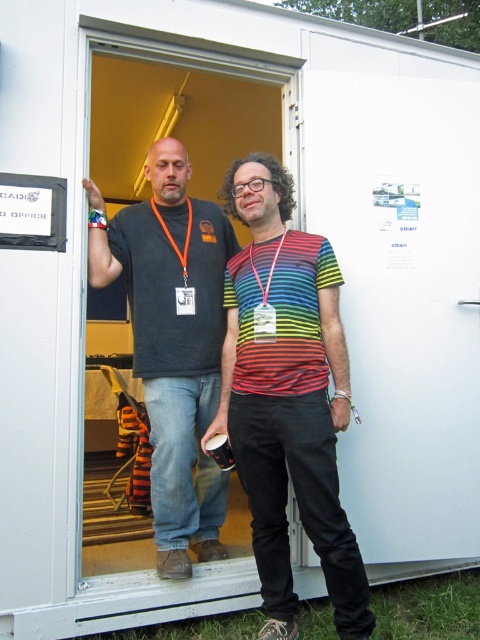
Question: Which object is farther from the camera taking this photo?

Choices:
 (A) orange fabric lanyard at center
 (B) dark gray t-shirt at center

Answer: (A)

Question: Is dark gray t-shirt at center behind orange fabric lanyard at center?

Choices:
 (A) yes
 (B) no

Answer: (B)

Question: Which object appears farthest from the camera in this image?

Choices:
 (A) dark gray t-shirt at center
 (B) orange fabric lanyard at center
 (C) rainbow striped shirt at center

Answer: (B)

Question: Is rainbow striped shirt at center below orange fabric lanyard at center?

Choices:
 (A) no
 (B) yes

Answer: (B)

Question: Which of the following is the closest to the observer?

Choices:
 (A) (190, 211)
 (B) (288, 627)

Answer: (B)

Question: Is dark gray t-shirt at center thinner than orange fabric lanyard at center?

Choices:
 (A) yes
 (B) no

Answer: (B)